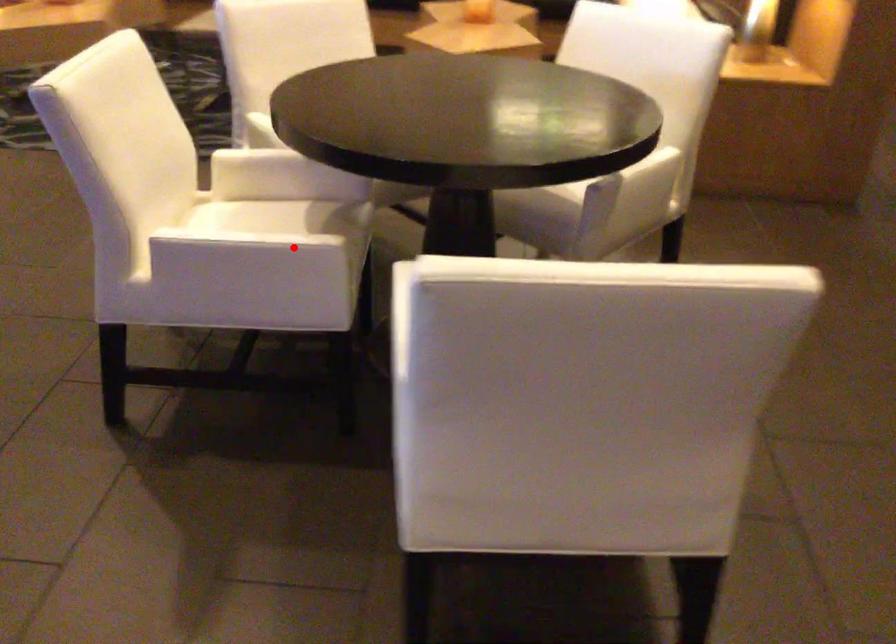
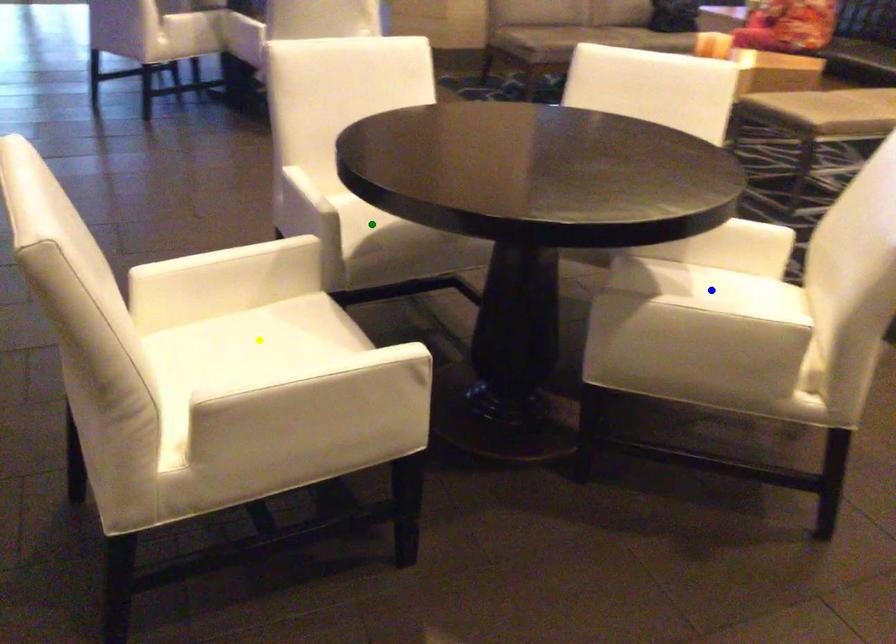
Question: I am providing you with two images of the same scene from different viewpoints. A red point is marked on the first image. You are given multiple points on the second image. In image 2, which mark is for the same physical point as the one in image 1?

Choices:
 (A) blue point
 (B) green point
 (C) yellow point

Answer: (B)